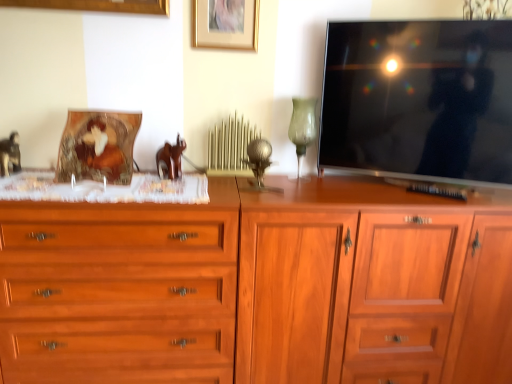
Question: Is point (169, 144) positioned closer to the camera than point (297, 155)?

Choices:
 (A) closer
 (B) farther

Answer: (A)

Question: Looking at their shapes, would you say brown wooden horse at center is wider or thinner than green glass vase at upper center, placed as the 1th table lamp when sorted from right to left?

Choices:
 (A) thin
 (B) wide

Answer: (A)

Question: Which object is positioned closest to the wooden cabinet at center, which is the first chest of drawers in right-to-left order?

Choices:
 (A) wooden chest of drawers at left, the 1th chest of drawers when ordered from left to right
 (B) matte black tv at upper right
 (C) metallic silver table lamp at center, marked as the first table lamp in a left-to-right arrangement
 (D) gold matte picture frame at upper center
 (E) brown wooden horse at center

Answer: (A)

Question: Considering the real-world distances, which object is closest to the brown wooden horse at center?

Choices:
 (A) matte black tv at upper right
 (B) green glass vase at upper center, placed as the 1th table lamp when sorted from right to left
 (C) wooden cabinet at center, the 2th chest of drawers from the left
 (D) gold matte picture frame at upper center
 (E) wooden chest of drawers at left, the 1th chest of drawers when ordered from left to right

Answer: (D)